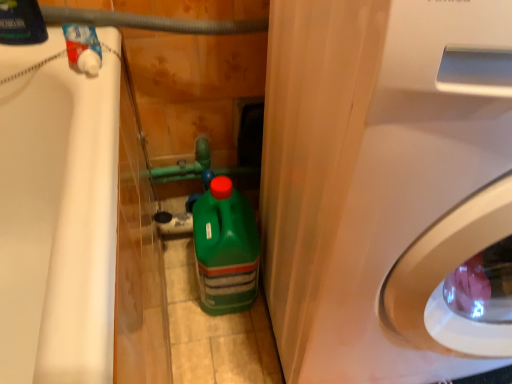
Question: In terms of width, does rubber hose at upper center look wider or thinner when compared to matte black bottle at upper left?

Choices:
 (A) wide
 (B) thin

Answer: (B)

Question: Looking at the image, does rubber hose at upper center seem bigger or smaller compared to matte black bottle at upper left?

Choices:
 (A) big
 (B) small

Answer: (B)

Question: Which of these objects is positioned farthest from the green plastic bottle at center?

Choices:
 (A) matte black bottle at upper left
 (B) white glossy washing machine at center right
 (C) rubber hose at upper center

Answer: (A)

Question: Which of these objects is positioned closest to the white glossy washing machine at center right?

Choices:
 (A) matte black bottle at upper left
 (B) green plastic bottle at center
 (C) rubber hose at upper center

Answer: (B)